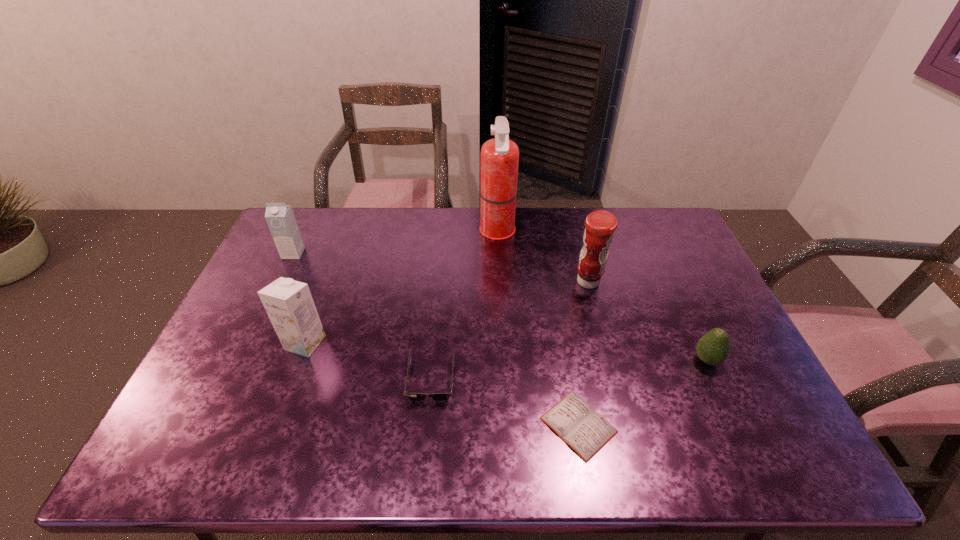
Image resolution: width=960 pixels, height=540 pixels. Find the location of `free space located 0.230m on the back of the diary`. free space located 0.230m on the back of the diary is located at coordinates (561, 322).

The height and width of the screenshot is (540, 960). Identify the location of object that is at the far edge. (499, 159).

The image size is (960, 540). In order to click on object located in the near edge section of the desktop in this screenshot , I will do point(586,431).

The image size is (960, 540). Find the location of `object that is at the left edge`. object that is at the left edge is located at coordinates tap(280, 218).

You are a GUI agent. You are given a task and a screenshot of the screen. Output one action in this format:
    pyautogui.click(x=<x>, y=<y>)
    Task: Click on the object at the right edge
    The height and width of the screenshot is (540, 960).
    Given the screenshot: What is the action you would take?
    pyautogui.click(x=713, y=348)

I want to click on blank space at the far edge, so click(423, 224).

In the image, there is a desktop. Identify the location of free space at the near edge. (289, 463).

In the image, there is a desktop. Where is `free space at the left edge`? The height and width of the screenshot is (540, 960). free space at the left edge is located at coordinates (249, 313).

Where is `vacant area at the right edge`? The width and height of the screenshot is (960, 540). vacant area at the right edge is located at coordinates (666, 272).

You are a GUI agent. You are given a task and a screenshot of the screen. Output one action in this format:
    pyautogui.click(x=<x>, y=<y>)
    Task: Click on the vacant region at the near left corner
    
    Given the screenshot: What is the action you would take?
    pyautogui.click(x=155, y=463)